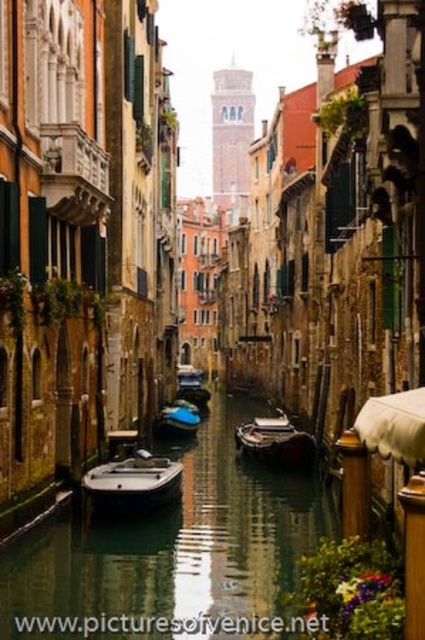
Does white matte boat at center have a lesser width compared to blue glossy boat at center?

In fact, white matte boat at center might be wider than blue glossy boat at center.

Which of these two, white matte boat at center or blue glossy boat at center, stands taller?

Standing taller between the two is white matte boat at center.

Where is `white matte boat at center`? The height and width of the screenshot is (640, 425). white matte boat at center is located at coordinates (133, 483).

You are a GUI agent. You are given a task and a screenshot of the screen. Output one action in this format:
    pyautogui.click(x=<x>, y=<y>)
    Task: Click on the white matte boat at center
    The height and width of the screenshot is (640, 425).
    Given the screenshot: What is the action you would take?
    pyautogui.click(x=133, y=483)

Is green glossy waterway at center wider than wooden polished boat at center?

Indeed, green glossy waterway at center has a greater width compared to wooden polished boat at center.

Who is more distant from viewer, (x=329, y=493) or (x=269, y=445)?

Point (x=269, y=445)

Between point (65, 628) and point (266, 440), which one is positioned behind?

The point (266, 440) is more distant.

Identify the location of green glossy waterway at center. The height and width of the screenshot is (640, 425). (172, 552).

Is wooden polished boat at center bigger than blue glossy boat at center?

Correct, wooden polished boat at center is larger in size than blue glossy boat at center.

Can you confirm if wooden polished boat at center is positioned above blue glossy boat at center?

Incorrect, wooden polished boat at center is not positioned above blue glossy boat at center.

Does point (271, 452) come farther from viewer compared to point (184, 410)?

No, (271, 452) is in front of (184, 410).

Identify the location of wooden polished boat at center. (275, 442).